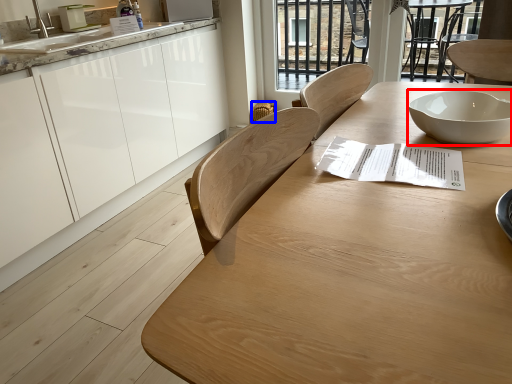
Question: Which of the following is the closest to the observer, bowl (highlighted by a red box) or chair (highlighted by a blue box)?

Choices:
 (A) bowl
 (B) chair

Answer: (A)